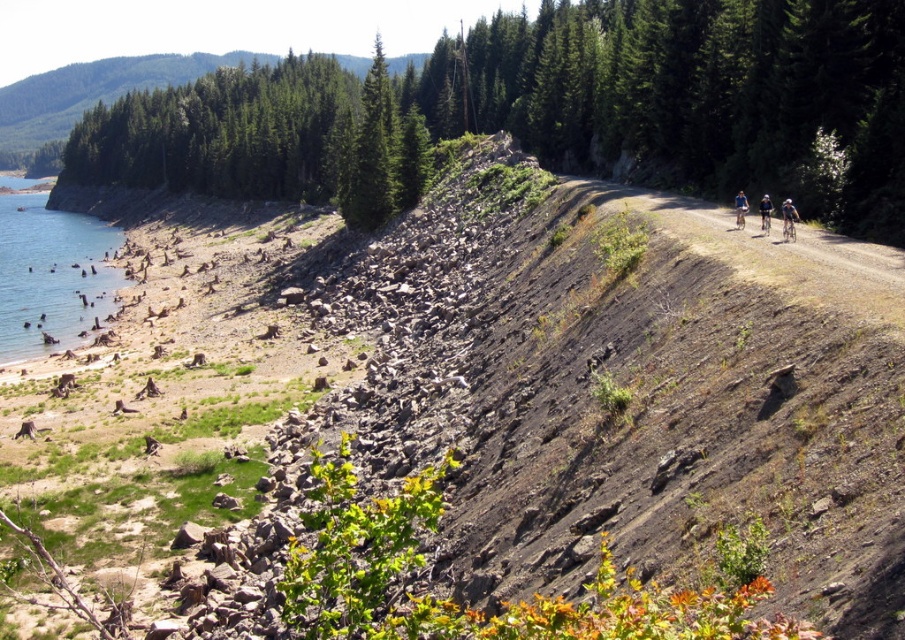
Question: Does clear blue water at lower left appear on the right side of blue fabric helmet at upper right?

Choices:
 (A) yes
 (B) no

Answer: (B)

Question: Among these points, which one is farthest from the camera?

Choices:
 (A) (81, 278)
 (B) (742, 198)
 (C) (786, 225)
 (D) (765, 195)

Answer: (A)

Question: Can you confirm if blue matte bicycle at center-right is smaller than light blue fabric helmet at upper right?

Choices:
 (A) no
 (B) yes

Answer: (A)

Question: Estimate the real-world distances between objects in this image. Which object is farther from the light blue fabric helmet at upper right?

Choices:
 (A) blue fabric helmet at upper right
 (B) blue matte bicycle at center-right

Answer: (B)

Question: Which point appears closest to the camera in this image?

Choices:
 (A) (770, 212)
 (B) (782, 218)
 (C) (737, 196)
 (D) (81, 280)

Answer: (A)

Question: In this image, where is blue fabric helmet at upper right located relative to light blue fabric helmet at upper right?

Choices:
 (A) below
 (B) above

Answer: (A)